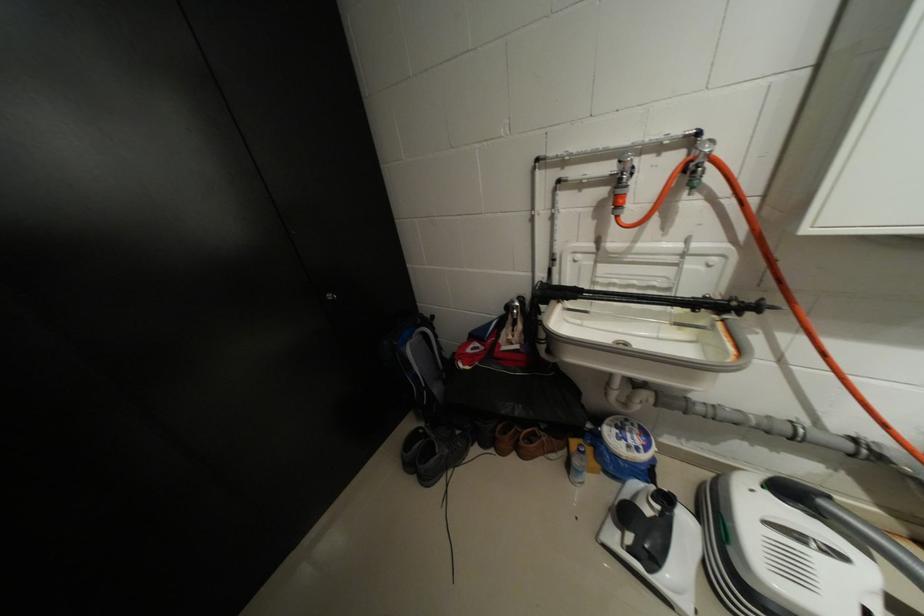
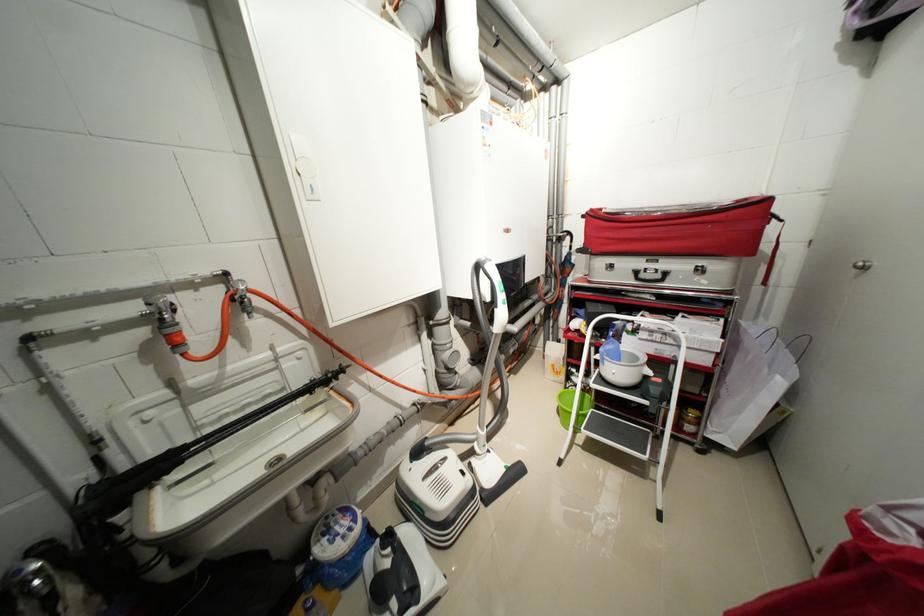
The point at (706, 167) is marked in the first image. Where is the corresponding point in the second image?

(249, 299)